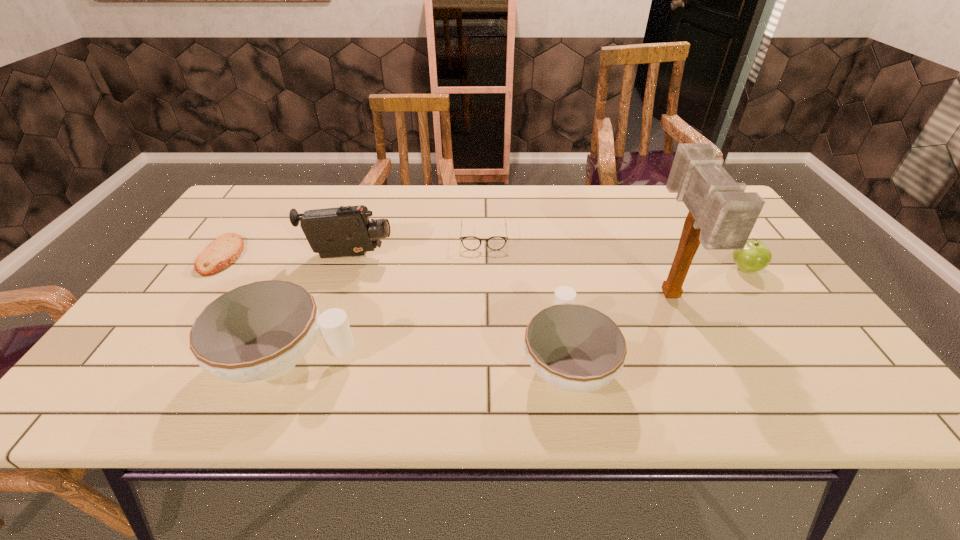
I want to click on free space located on the back of the mallet, so click(648, 248).

This screenshot has width=960, height=540. In order to click on object present at the far edge in this screenshot , I will do `click(495, 243)`.

Locate an element on the screen. Image resolution: width=960 pixels, height=540 pixels. object positioned at the left edge is located at coordinates (221, 253).

In order to click on object that is at the right edge in this screenshot , I will do `click(755, 256)`.

Where is `vacant area at the far edge`? vacant area at the far edge is located at coordinates (608, 222).

Find the location of a particular element. vacant space at the near edge of the desktop is located at coordinates (635, 339).

Find the location of a particular element. vacant space at the far left corner of the desktop is located at coordinates (242, 193).

In the image, there is a desktop. What are the coordinates of `vacant region at the near left corner` in the screenshot? It's located at (187, 357).

I want to click on free space between the mallet and the sixth tallest object, so click(x=577, y=266).

This screenshot has width=960, height=540. What are the coordinates of `vacant area that lies between the third object from right to left and the second shortest object` in the screenshot? It's located at (525, 299).